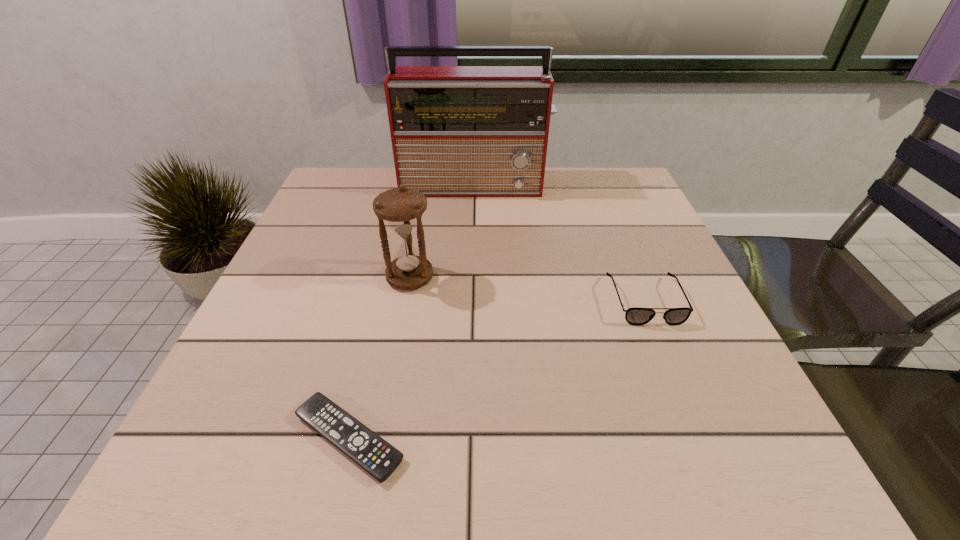
The width and height of the screenshot is (960, 540). I want to click on empty location between the hourglass and the radio receiver, so click(x=443, y=231).

Locate an element on the screen. Image resolution: width=960 pixels, height=540 pixels. empty space between the tallest object and the nearest object is located at coordinates (412, 312).

You are a GUI agent. You are given a task and a screenshot of the screen. Output one action in this format:
    pyautogui.click(x=<x>, y=<y>)
    Task: Click on the object that is the closest to the third tallest object
    This screenshot has width=960, height=540.
    Given the screenshot: What is the action you would take?
    pyautogui.click(x=457, y=131)

The width and height of the screenshot is (960, 540). I want to click on the third closest object to the remote control, so click(x=457, y=131).